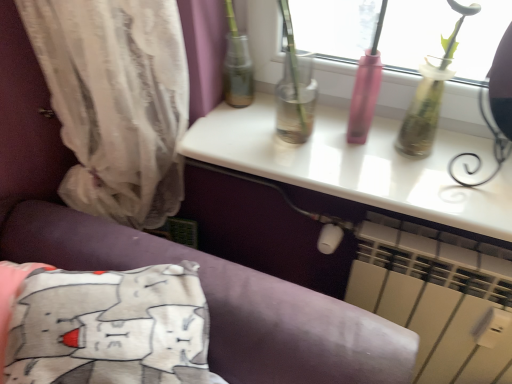
Question: In terms of size, does white plastic radiator at lower right appear bigger or smaller than translucent fabric curtain at left?

Choices:
 (A) small
 (B) big

Answer: (B)

Question: From the image's perspective, is white plastic radiator at lower right above or below translucent fabric curtain at left?

Choices:
 (A) above
 (B) below

Answer: (B)

Question: Estimate the real-world distances between objects in this image. Which object is closer to the white cotton pillow at lower left?

Choices:
 (A) white plastic radiator at lower right
 (B) white glossy table at upper center
 (C) translucent fabric curtain at left

Answer: (C)

Question: Based on their relative distances, which object is nearer to the white plastic radiator at lower right?

Choices:
 (A) white glossy table at upper center
 (B) translucent fabric curtain at left
 (C) white cotton pillow at lower left

Answer: (A)